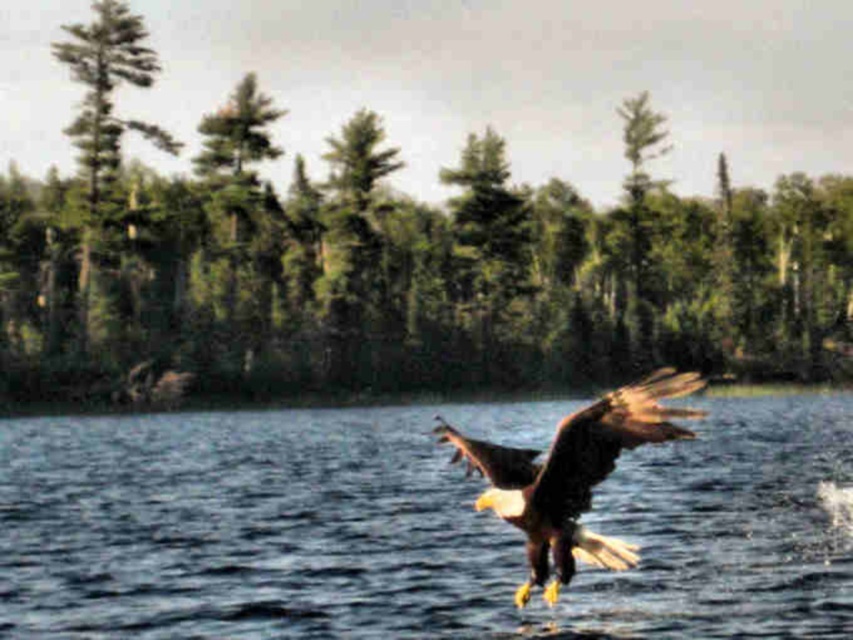
You are a photographer trying to capture the bald eagle in flight. You notice the blue water at center and the green textured tree at upper left in your viewfinder. Which object is located to the right of the other?

The blue water at center is positioned on the right side of green textured tree at upper left, so the blue water at center is to the right of the green textured tree at upper left.

In the scene shown: You are a wildlife photographer trying to capture the brown feathered eagle at center and the green textured tree at upper left in the same frame. Based on their sizes, which one would appear closer to the camera?

The brown feathered eagle at center appears closer to the camera because it has a smaller size compared to the green textured tree at upper left, indicating it is nearer in the frame.

In the scene shown: You are a birdwatcher trying to estimate distances in the scene. Given that the green textured tree at center and the brown feathered eagle at center are both in the center area, can you determine which one is closer to you based on their positions?

The green textured tree at center and brown feathered eagle at center are 99.42 meters apart from each other, so it is impossible to determine which is closer based solely on their positions as they are both at the center but separated by that distance.